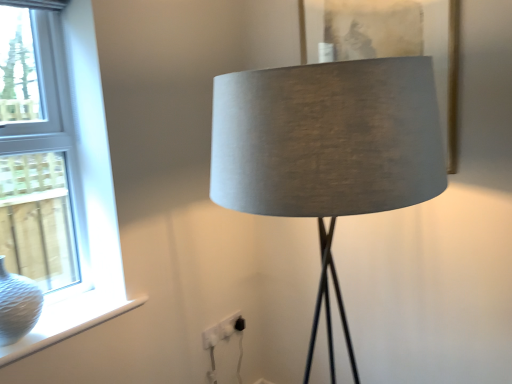
Question: Considering the positions of satin grey lampshade at center and white textured vase at lower left in the image, is satin grey lampshade at center wider or thinner than white textured vase at lower left?

Choices:
 (A) thin
 (B) wide

Answer: (B)

Question: Considering the positions of point (348, 77) and point (117, 311), is point (348, 77) closer or farther from the camera than point (117, 311)?

Choices:
 (A) closer
 (B) farther

Answer: (A)

Question: Which object is the farthest from the satin grey lampshade at center?

Choices:
 (A) white glass window at left
 (B) white textured vase at lower left
 (C) white textured glass vase at left
 (D) matte gray fabric picture frame at center

Answer: (C)

Question: Based on their relative distances, which object is nearer to the white textured glass vase at left?

Choices:
 (A) satin grey lampshade at center
 (B) white textured vase at lower left
 (C) white glass window at left
 (D) matte gray fabric picture frame at center

Answer: (B)